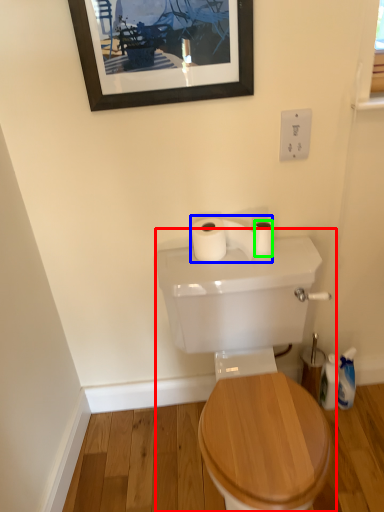
Question: Estimate the real-world distances between objects in this image. Which object is closer to sink (highlighted by a red box), toilet paper (highlighted by a blue box) or toilet paper (highlighted by a green box)?

Choices:
 (A) toilet paper
 (B) toilet paper

Answer: (A)